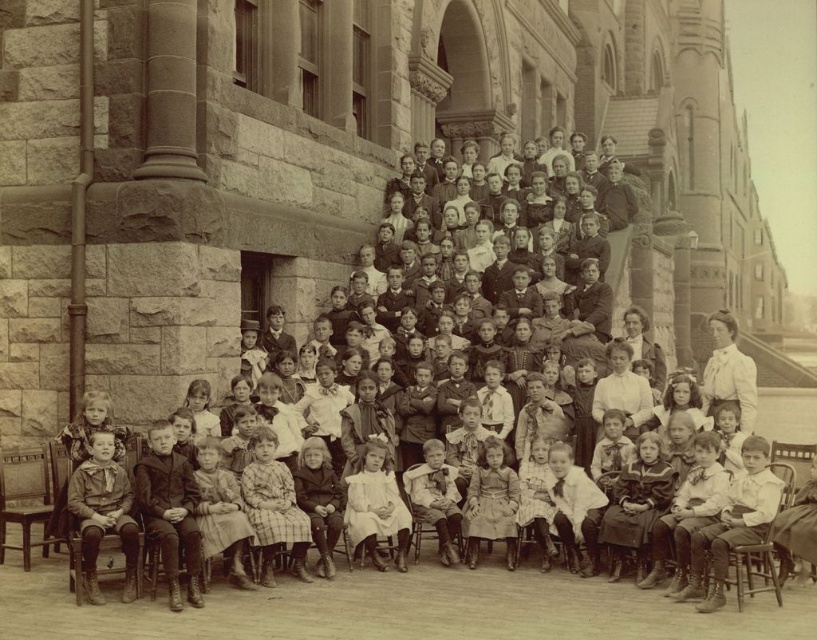
Is point (106, 472) in front of point (740, 573)?

No, it is not.

What are the coordinates of `matte brown boots at lower left` in the screenshot? It's located at (103, 513).

Locate an element on the screen. This screenshot has width=817, height=640. matte brown boots at lower left is located at coordinates (103, 513).

Does wooden chair at lower left have a lesser height compared to wooden at right?

In fact, wooden chair at lower left may be taller than wooden at right.

Describe the element at coordinates (25, 499) in the screenshot. I see `wooden chair at lower left` at that location.

This screenshot has height=640, width=817. Identify the location of wooden chair at lower left. (25, 499).

Measure the distance from matte brown boots at lower left to white lace blouse at upper right.

They are 87.66 feet apart.

I want to click on matte brown boots at lower left, so click(x=103, y=513).

Identify the location of matte brown boots at lower left. This screenshot has height=640, width=817. (103, 513).